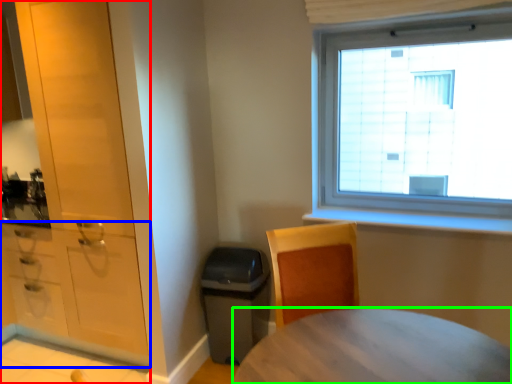
Question: Estimate the real-world distances between objects in this image. Which object is farther from cabinetry (highlighted by a red box), cabinetry (highlighted by a blue box) or desk (highlighted by a green box)?

Choices:
 (A) cabinetry
 (B) desk

Answer: (B)